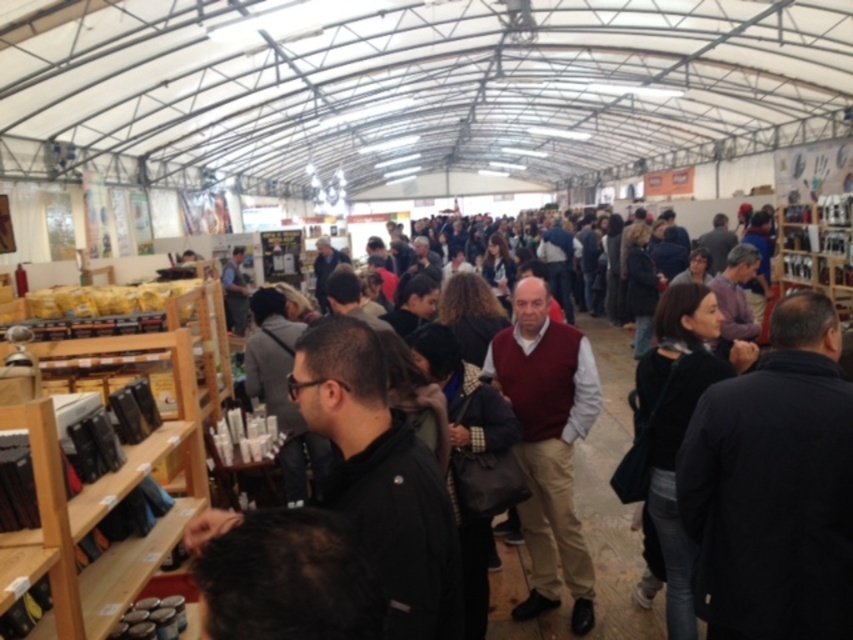
Question: Which of the following is the closest to the observer?

Choices:
 (A) (167, 451)
 (B) (590, 605)

Answer: (A)

Question: Is wooden shelves at left positioned before maroon sweater at center?

Choices:
 (A) yes
 (B) no

Answer: (A)

Question: Can you confirm if wooden shelves at left is positioned below maroon sweater at center?

Choices:
 (A) yes
 (B) no

Answer: (B)

Question: Does wooden shelves at left appear on the right side of maroon sweater at center?

Choices:
 (A) no
 (B) yes

Answer: (A)